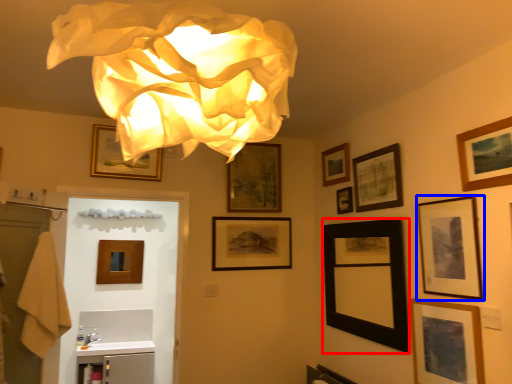
Question: Which object is further to the camera taking this photo, picture frame (highlighted by a red box) or picture frame (highlighted by a blue box)?

Choices:
 (A) picture frame
 (B) picture frame

Answer: (A)